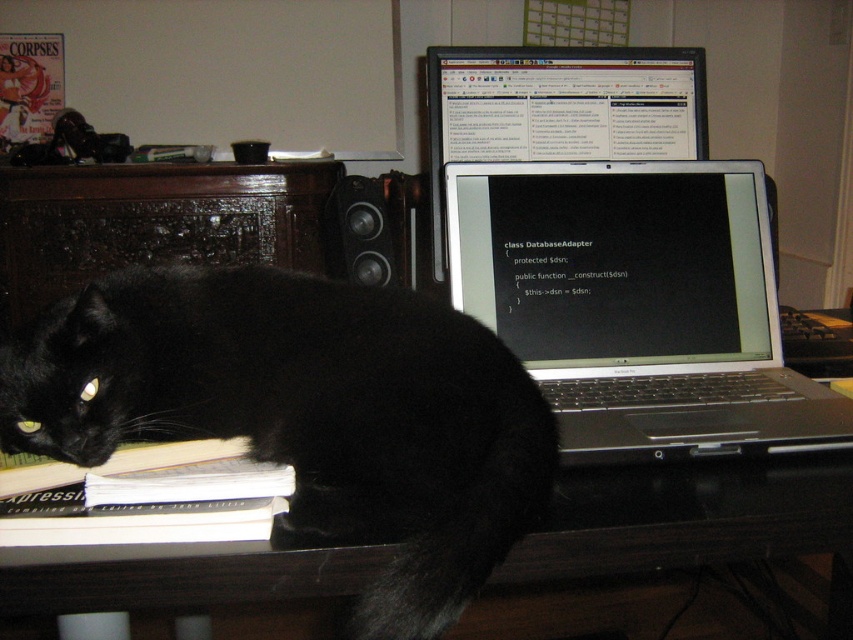
You are organizing your desk and want to place a new item between the black wooden table at lower left and the black glossy laptop at upper center. Based on their positions, where should you place the item to ensure it is centered between them?

The black wooden table at lower left is to the left of the black glossy laptop at upper center, so placing the item halfway between them along the horizontal axis would center it between the two objects.

You are organizing a desk and need to place a new item between the black fur cat at left and the white paper book at lower left. Considering their sizes, which object should you place closer to the edge of the desk to ensure there is enough space?

The white paper book at lower left is smaller than the black fur cat at left, so you should place the white paper book at lower left closer to the edge of the desk to accommodate the larger cat.